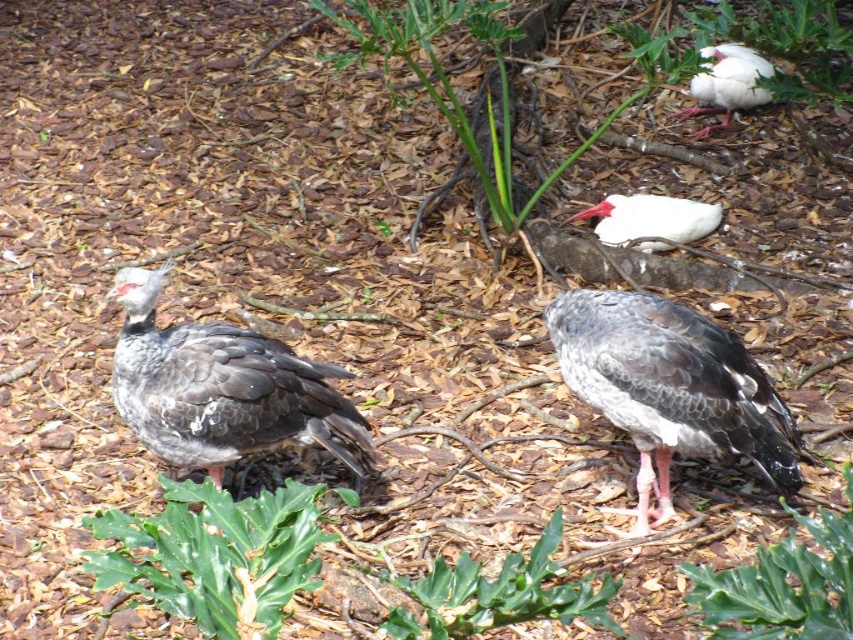
You are a photographer trying to capture a clear shot of the dark gray feathers at center and the white matte bird at upper right. Since you want both subjects in focus, which one should you adjust your camera focus to prioritize? Explain your reasoning based on their positions in the scene.

You should prioritize focusing on the dark gray feathers at center because it is closer to the viewer than the white matte bird at upper right. By focusing on the closer subject, you can ensure that both will be in focus due to the depth of field extending from the closer subject to the background.

You are a birdwatcher observing the scene. You notice the gray matte bird at center and the dark gray feathers at center. Which object is bigger in size?

The gray matte bird at center is larger in size compared to the dark gray feathers at center.